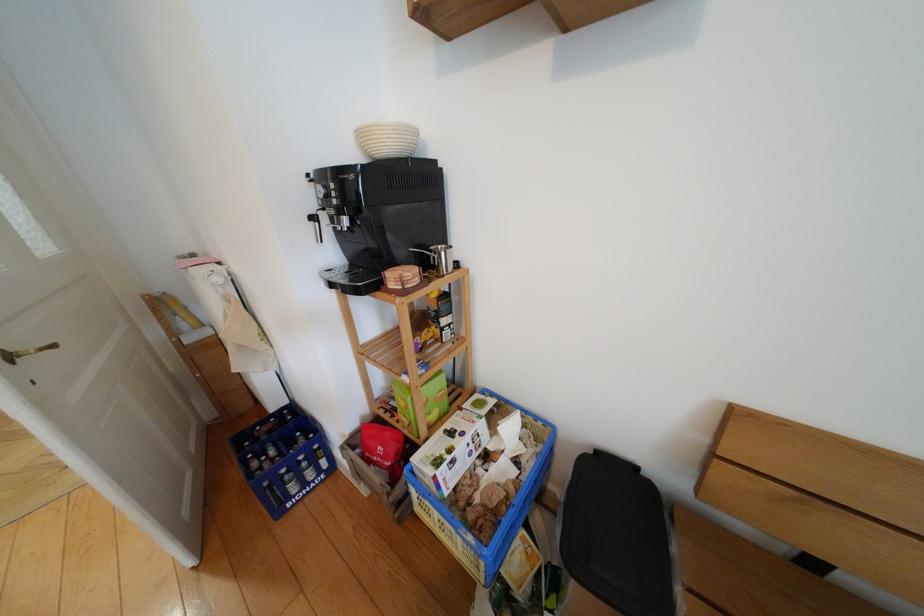
Find the location of `coffee machine dial`. coffee machine dial is located at coordinates (315, 225).